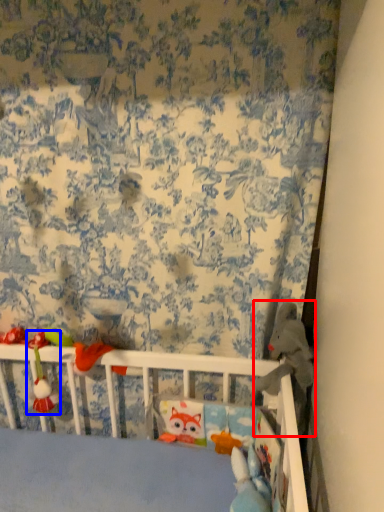
Question: Which point is further to the camera, toy (highlighted by a red box) or toy (highlighted by a blue box)?

Choices:
 (A) toy
 (B) toy

Answer: (B)